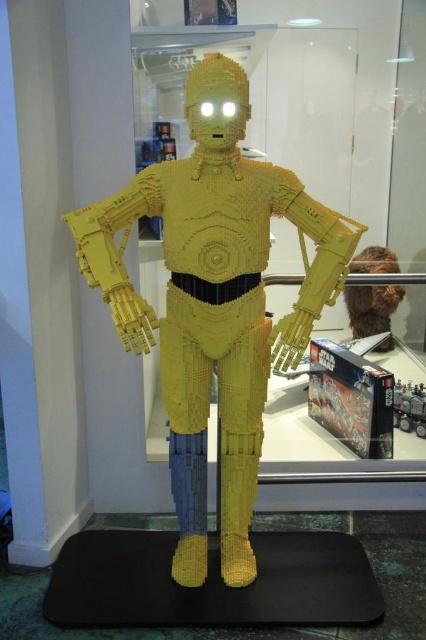
You are a photographer standing 5 feet away from the yellow lego robot at center. You want to take a closeup shot of it without moving your position. Is your current distance sufficient to capture the robot in focus?

The yellow lego robot at center is 4.95 feet from camera, so yes, your current distance of 5 feet is sufficient to capture the robot in focus as it is within the required range.

You are a photographer setting up a shot of the C3PO LEGO model. You want to place a small LED light at the exact center of the image. Will the light interfere with the brown fuzzy wig at upper right? Please explain.

The brown fuzzy wig at upper right is located at point (371, 307). The exact center of the image is at point (213, 320). Since the wig is at (371, 307), which is close to the upper right corner, it will not interfere with the center placement of the LED light.